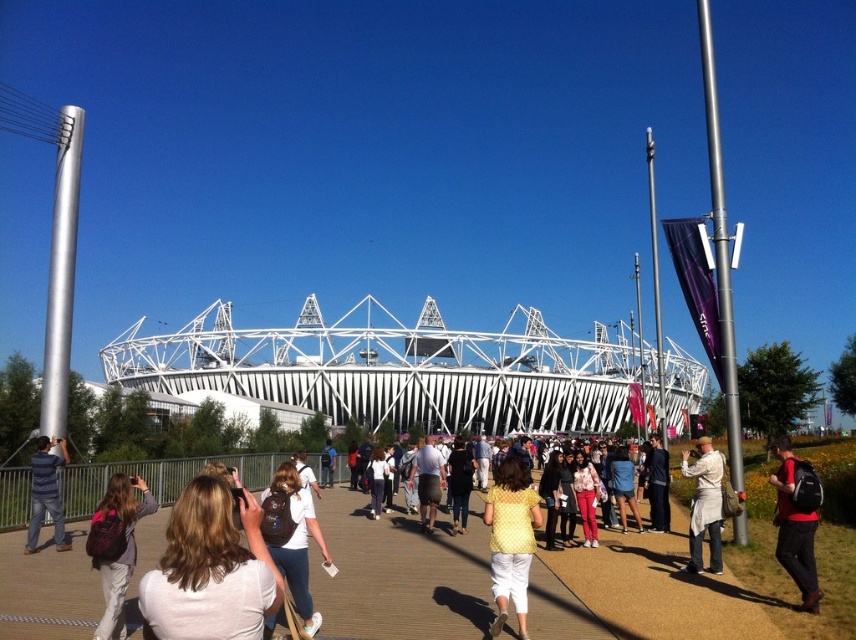
Does brown textured boardwalk at center appear on the right side of white matte shirt at center?

Yes, brown textured boardwalk at center is to the right of white matte shirt at center.

Is point (18, 531) less distant than point (212, 492)?

No, (18, 531) is behind (212, 492).

Identify the location of brown textured boardwalk at center. The image size is (856, 640). (682, 592).

Does khaki shorts at center come in front of white cotton shirt at center?

That is False.

Is khaki shorts at center above white cotton shirt at center?

Actually, khaki shorts at center is below white cotton shirt at center.

Between point (438, 458) and point (304, 472), which one is positioned behind?

Positioned behind is point (438, 458).

Identify the location of khaki shorts at center. The width and height of the screenshot is (856, 640). (428, 481).

Can you confirm if matte pink backpack at lower left is positioned below light brown backpack at center?

Yes.

Which is in front, point (107, 609) or point (327, 465)?

Point (107, 609) is more forward.

I want to click on matte pink backpack at lower left, so click(x=117, y=548).